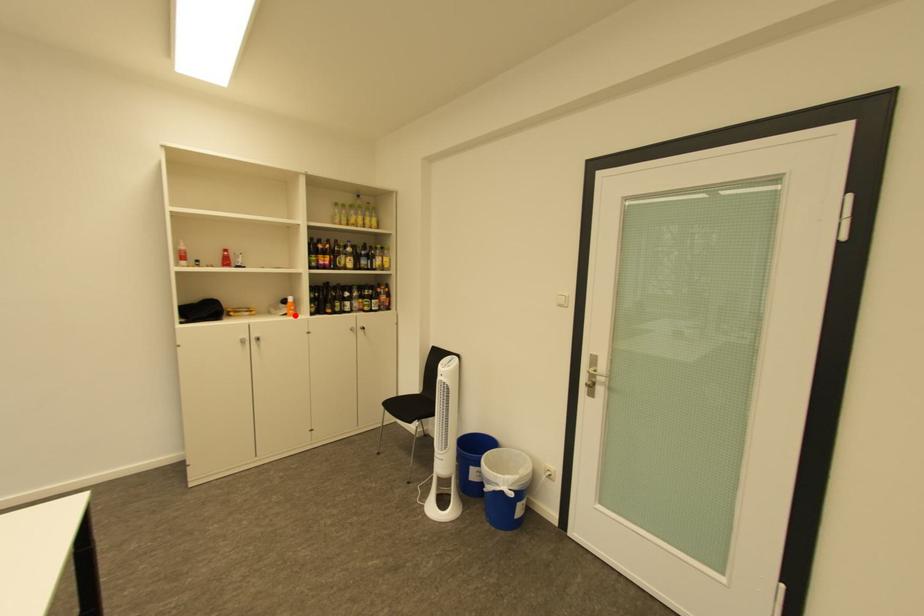
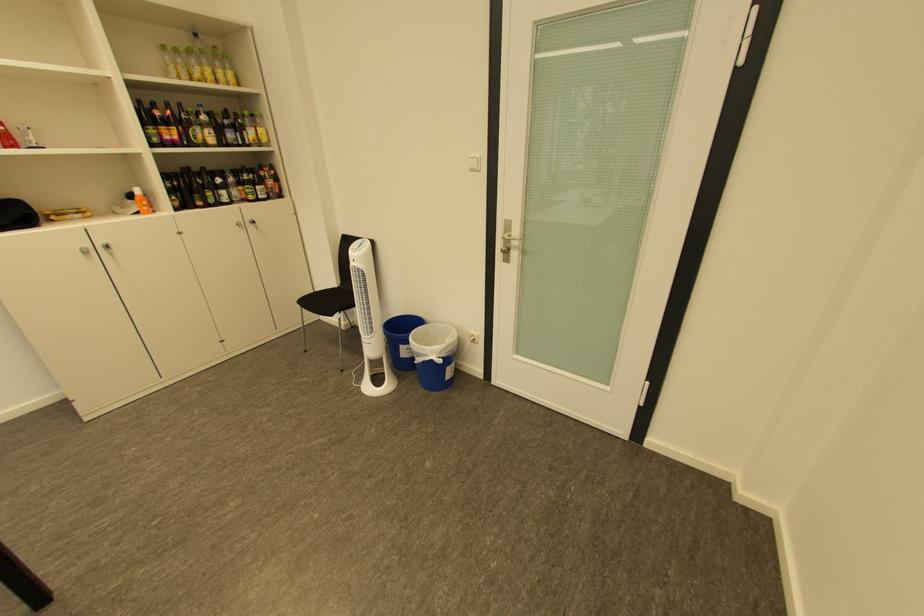
In the second image, find the point that corresponds to the highlighted location in the first image.

(148, 214)